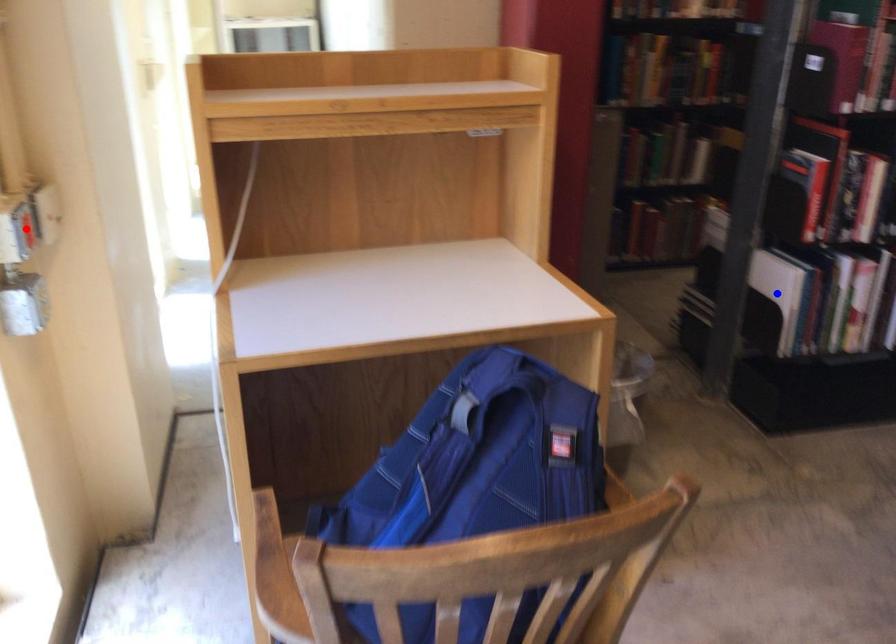
Question: Two points are marked on the image. Which point is closer to the camera?

Choices:
 (A) Blue point is closer.
 (B) Red point is closer.

Answer: (B)